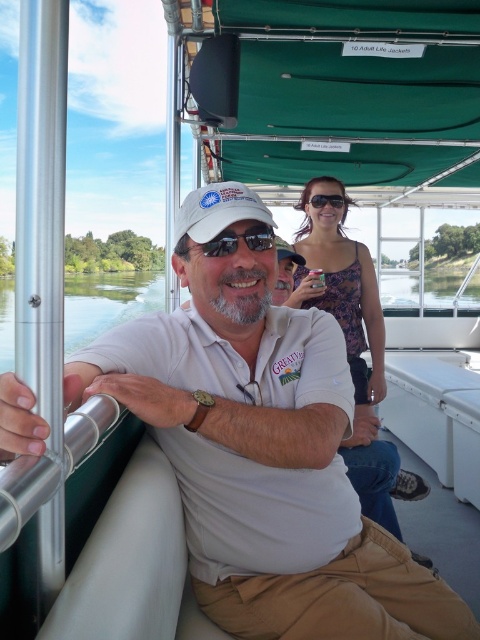
You are standing on the pontoon boat looking towards the front of the boat. There are two points marked on the boat deck. The first point is at coordinate point (307, 256) and the second is at coordinate point (222, 237). Which point is closer to the front of the boat?

Point (222, 237) is closer to the front of the boat because it is in front of point (307, 256).